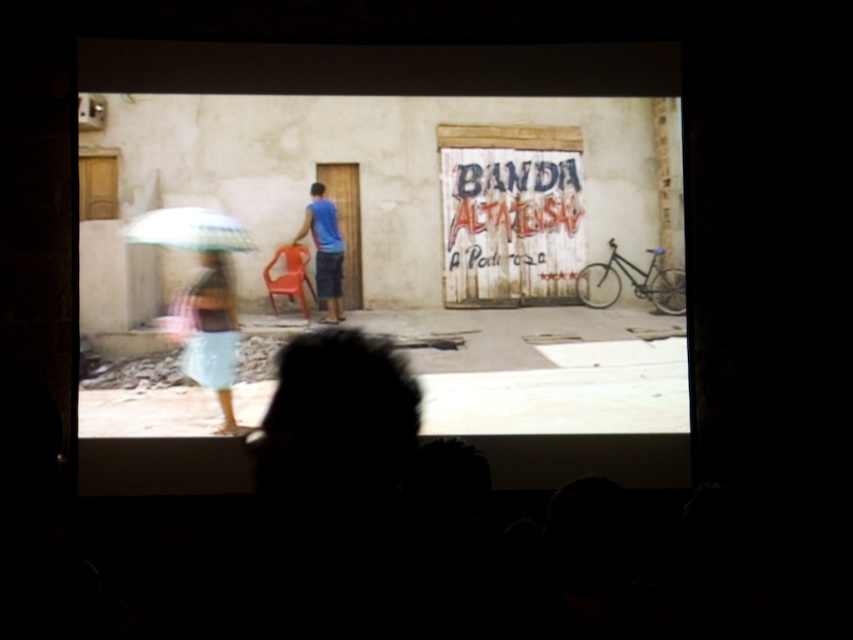
Question: Does plaid fabric umbrella at left have a greater width compared to blue matte shirt at center?

Choices:
 (A) no
 (B) yes

Answer: (B)

Question: Which point is closer to the camera?

Choices:
 (A) (183, 234)
 (B) (207, 304)
 (C) (334, 296)

Answer: (B)

Question: Which of the following is the closest to the observer?

Choices:
 (A) translucent plastic umbrella at left
 (B) blue matte shirt at center

Answer: (A)

Question: In this image, where is plaid fabric umbrella at left located relative to blue matte shirt at center?

Choices:
 (A) above
 (B) below

Answer: (B)

Question: Among these objects, which one is nearest to the camera?

Choices:
 (A) blue matte shirt at center
 (B) plaid fabric umbrella at left
 (C) translucent plastic umbrella at left

Answer: (B)

Question: In this image, where is plaid fabric umbrella at left located relative to blue matte shirt at center?

Choices:
 (A) below
 (B) above

Answer: (A)